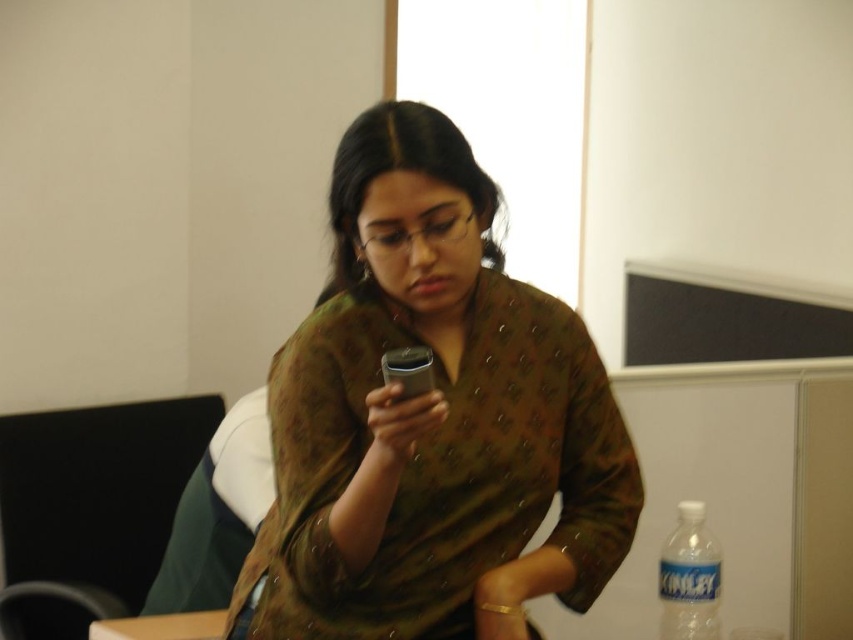
Does point (706, 580) come in front of point (103, 637)?

That is True.

Does clear plastic bottle at lower right have a smaller size compared to wooden table at lower left?

No.

The image size is (853, 640). I want to click on clear plastic bottle at lower right, so click(689, 577).

Which of these two, brown textured shawl at center or wooden table at lower left, stands taller?

Standing taller between the two is brown textured shawl at center.

Locate an element on the screen. The image size is (853, 640). brown textured shawl at center is located at coordinates (431, 419).

Identify the location of brown textured shawl at center. The height and width of the screenshot is (640, 853). (431, 419).

Who is more distant from viewer, (697, 577) or (709, 588)?

Positioned behind is point (709, 588).

From the picture: Measure the distance between clear plastic bottle at lower right and camera.

The distance of clear plastic bottle at lower right from camera is 4.48 feet.

What do you see at coordinates (689, 577) in the screenshot?
I see `clear plastic bottle at lower right` at bounding box center [689, 577].

Locate an element on the screen. The height and width of the screenshot is (640, 853). clear plastic bottle at lower right is located at coordinates (689, 577).